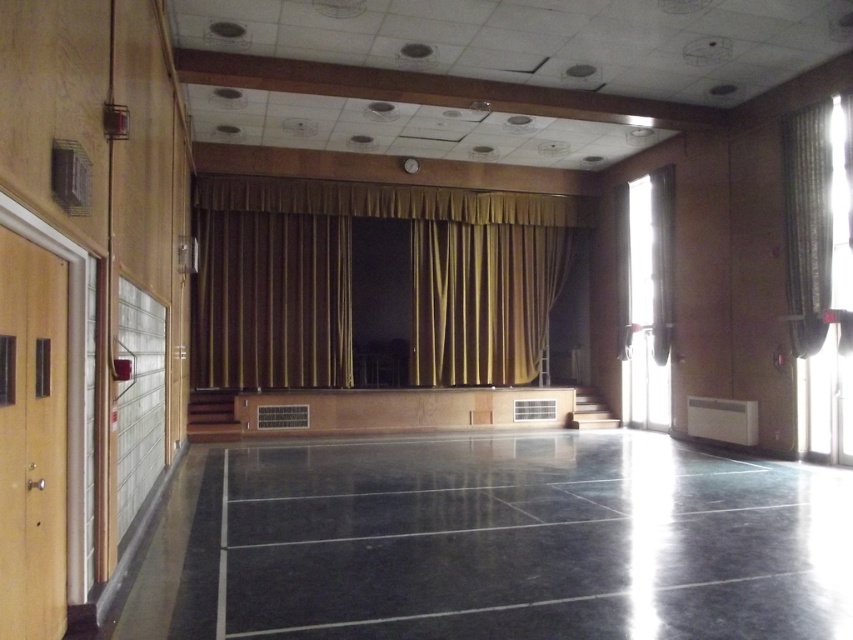
Based on the photo, you are planning to host a large event in the community hall and need to place a 10x10 meter dance floor. The black polished floor at center and gold textured curtain at right are in the way. Which object can you move to accommodate the dance floor?

The gold textured curtain at right can be moved since the black polished floor at center is larger in size and cannot be easily relocated.

You are a stagehand preparing to open the curtains for a performance. You need to move from the main floor to the stage. Which curtain should you move first to the side, the gold fabric curtain at center or the gold textured curtain at right, so you can access the stage?

The gold fabric curtain at center is positioned on the left side of the gold textured curtain at right, so you should move the gold fabric curtain at center first to access the stage.